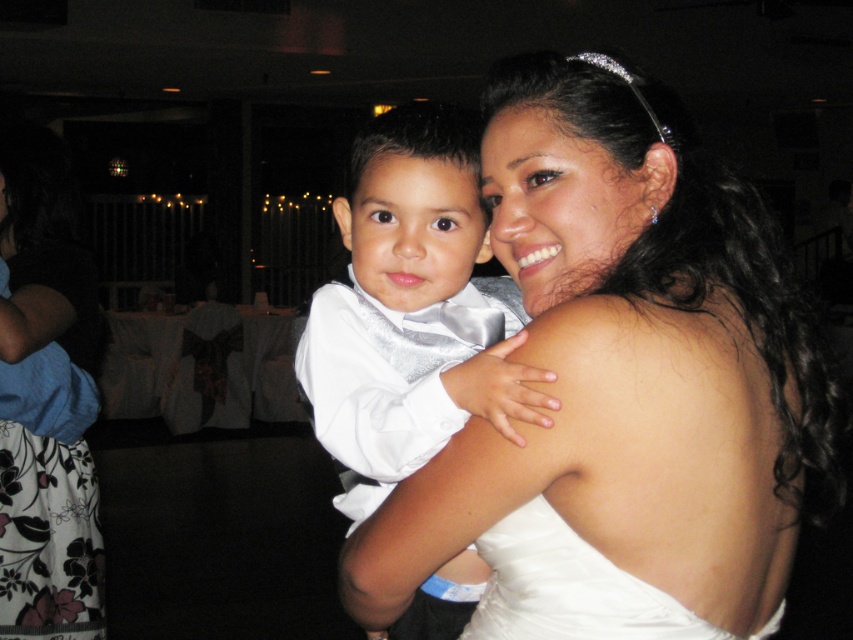
The height and width of the screenshot is (640, 853). Describe the element at coordinates (630, 358) in the screenshot. I see `white satin dress at upper center` at that location.

Can you confirm if white satin dress at upper center is taller than white satin dress at center?

Yes, white satin dress at upper center is taller than white satin dress at center.

Which is behind, point (556, 72) or point (672, 616)?

The point (556, 72) is behind.

Where is `white satin dress at upper center`? This screenshot has width=853, height=640. white satin dress at upper center is located at coordinates (630, 358).

Is the position of white satin dress at upper center less distant than that of white satin bow tie at center?

No, white satin dress at upper center is behind white satin bow tie at center.

Which is above, white satin dress at upper center or white satin bow tie at center?

white satin bow tie at center

Describe the element at coordinates (630, 358) in the screenshot. I see `white satin dress at upper center` at that location.

Identify the location of white satin dress at upper center. (630, 358).

Is white satin bow tie at center positioned before white satin dress at center?

Yes, white satin bow tie at center is in front of white satin dress at center.

Who is more distant from viewer, (476, 182) or (486, 630)?

Point (476, 182)

Which is behind, point (500, 392) or point (573, 589)?

The point (573, 589) is more distant.

Locate an element on the screen. Image resolution: width=853 pixels, height=640 pixels. white satin bow tie at center is located at coordinates (410, 307).